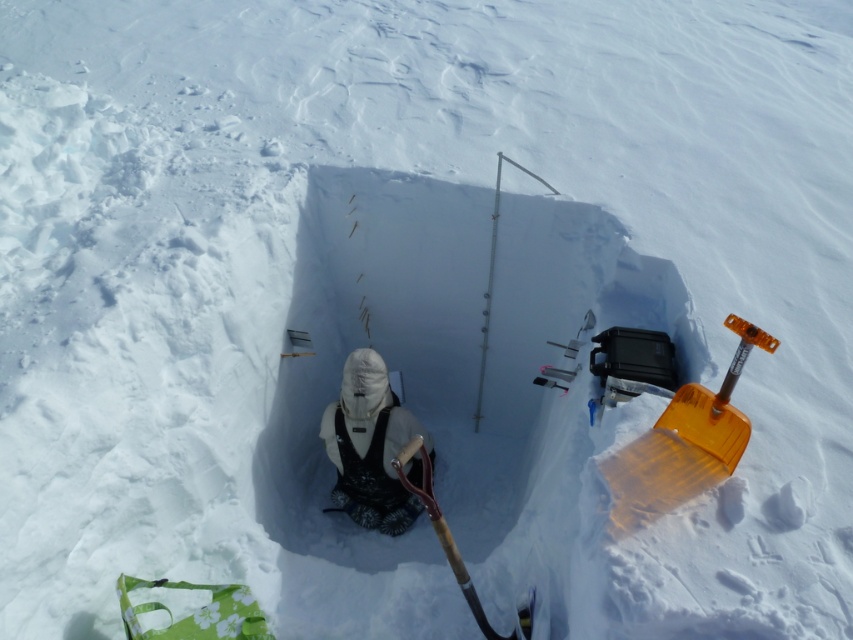
You are a researcher in the field and need to retrieve the white fleece jacket at center from the hole. The translucent orange shovel at right is in your way. Can you move the shovel to access the jacket?

The translucent orange shovel at right is closer to the viewer than the white fleece jacket at center, so you can move the shovel to access the jacket since it is in front of the jacket.

Looking at this image, you are a researcher in the Arctic and need to choose a shovel to dig through the hard ice layer. You have two options available in the scene, the translucent orange shovel at right and the wooden shovel at center. Based on their sizes, which shovel would be more suitable for breaking through the ice?

The translucent orange shovel at right is larger in size than the wooden shovel at center, making it more suitable for breaking through the ice as its increased size provides better leverage and force.